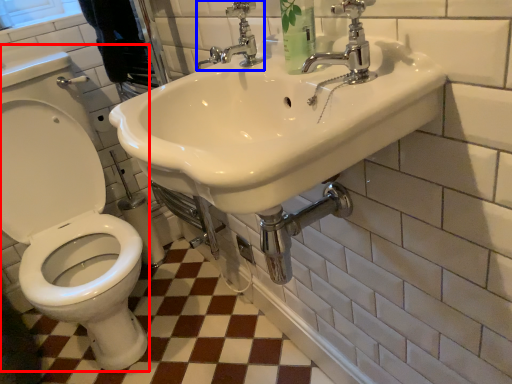
Question: Which of the following is the closest to the observer, sit (highlighted by a red box) or tap (highlighted by a blue box)?

Choices:
 (A) sit
 (B) tap

Answer: (B)